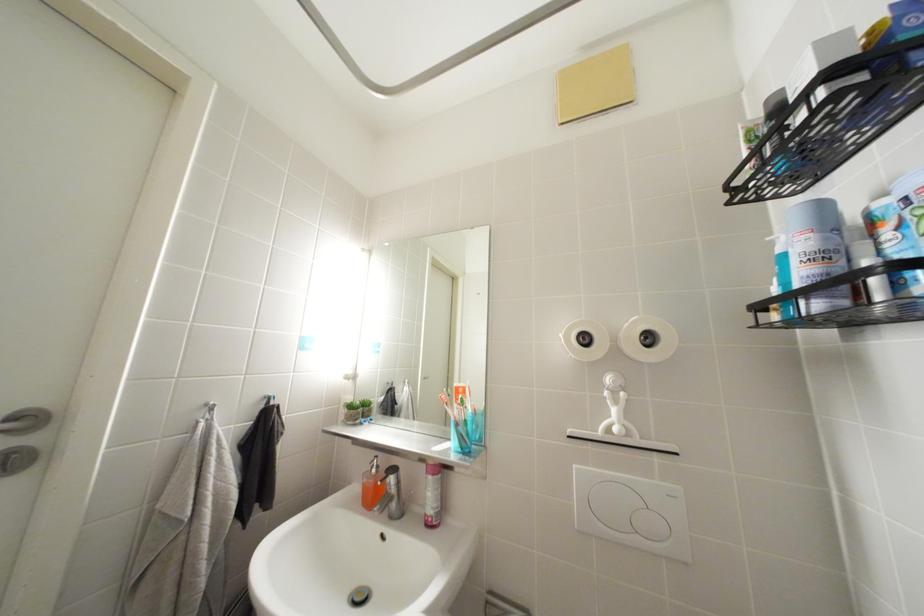
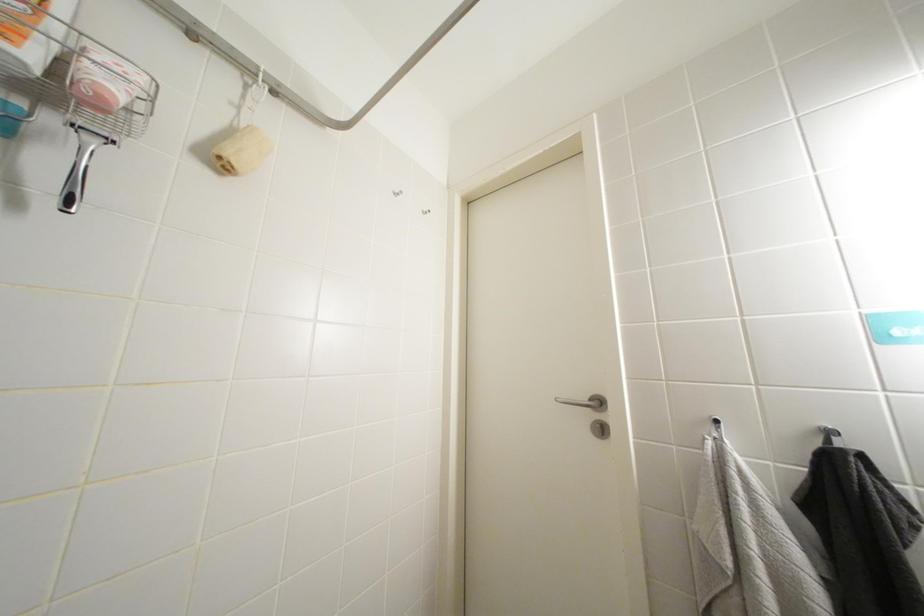
How did the camera likely rotate?

The camera's rotation is toward left-up.